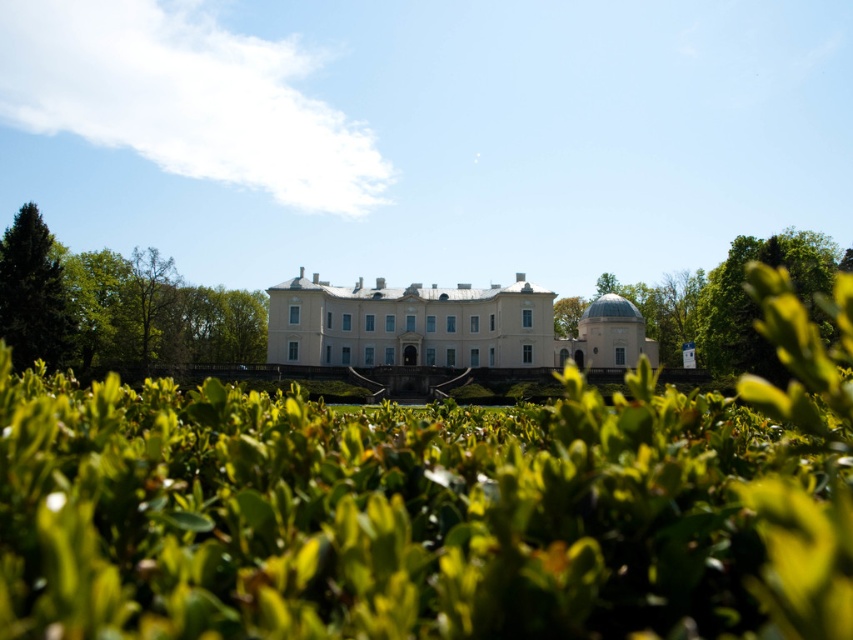
Question: Can you confirm if white smooth palace at center is positioned to the right of green leafy tree at upper left?

Choices:
 (A) yes
 (B) no

Answer: (A)

Question: Which is nearer to the green leafy tree at upper left?

Choices:
 (A) white smooth palace at center
 (B) green needle-like at left

Answer: (B)

Question: Which point appears closest to the camera in this image?

Choices:
 (A) (538, 339)
 (B) (755, 340)
 (C) (30, 234)
 (D) (38, 230)

Answer: (B)

Question: Does green leafy hedge at center come in front of green needle-like at left?

Choices:
 (A) no
 (B) yes

Answer: (B)

Question: Can you confirm if green leafy bush at right is positioned below green needle-like at left?

Choices:
 (A) no
 (B) yes

Answer: (A)

Question: Which object is closer to the camera taking this photo?

Choices:
 (A) green leafy hedge at center
 (B) green needle-like at left
 (C) green leafy bush at right
 (D) white smooth palace at center

Answer: (A)